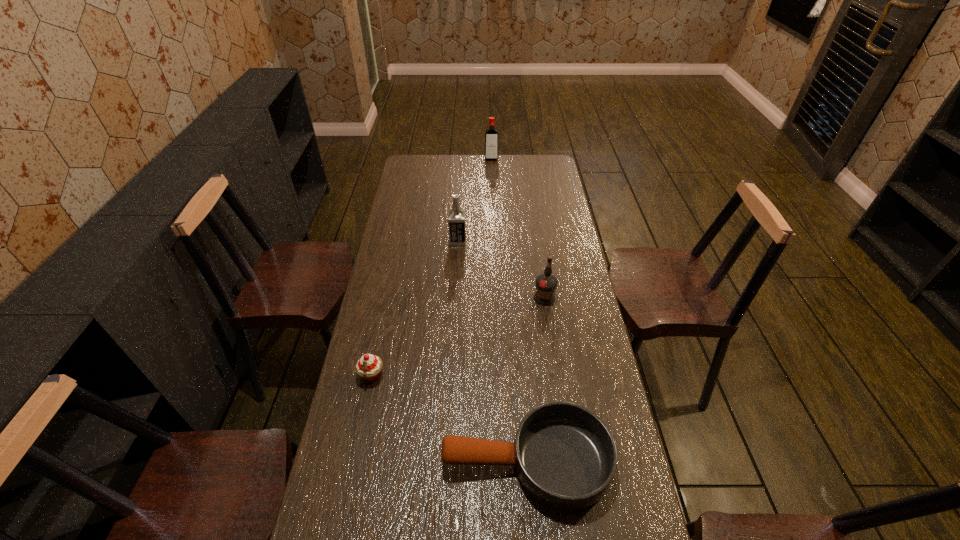
The image size is (960, 540). Find the location of `pan present at the right edge`. pan present at the right edge is located at coordinates (565, 456).

You are a GUI agent. You are given a task and a screenshot of the screen. Output one action in this format:
    pyautogui.click(x=<x>, y=<y>)
    Task: Click on the free location at the far edge of the desktop
    
    Given the screenshot: What is the action you would take?
    pyautogui.click(x=456, y=163)

This screenshot has height=540, width=960. In order to click on vacant region at the left edge of the desktop in this screenshot , I will do `click(382, 508)`.

You are a GUI agent. You are given a task and a screenshot of the screen. Output one action in this format:
    pyautogui.click(x=<x>, y=<y>)
    Task: Click on the vacant region at the right edge of the desktop
    This screenshot has width=960, height=540.
    Given the screenshot: What is the action you would take?
    pyautogui.click(x=552, y=220)

Image resolution: width=960 pixels, height=540 pixels. In the image, there is a desktop. In order to click on free space at the far right corner in this screenshot , I will do `click(529, 158)`.

Image resolution: width=960 pixels, height=540 pixels. Identify the location of free space between the leftmost object and the third nearest object. (458, 337).

This screenshot has width=960, height=540. I want to click on free space between the rightmost vodka and the second vodka from left to right, so click(x=517, y=228).

Identify the location of vacant area between the cupcake and the second farthest object. (415, 308).

Where is `vacant space that is in between the pan and the leftmost vodka`? vacant space that is in between the pan and the leftmost vodka is located at coordinates (492, 351).

This screenshot has width=960, height=540. Find the location of `free space between the leftmost object and the leftmost vodka`. free space between the leftmost object and the leftmost vodka is located at coordinates (415, 308).